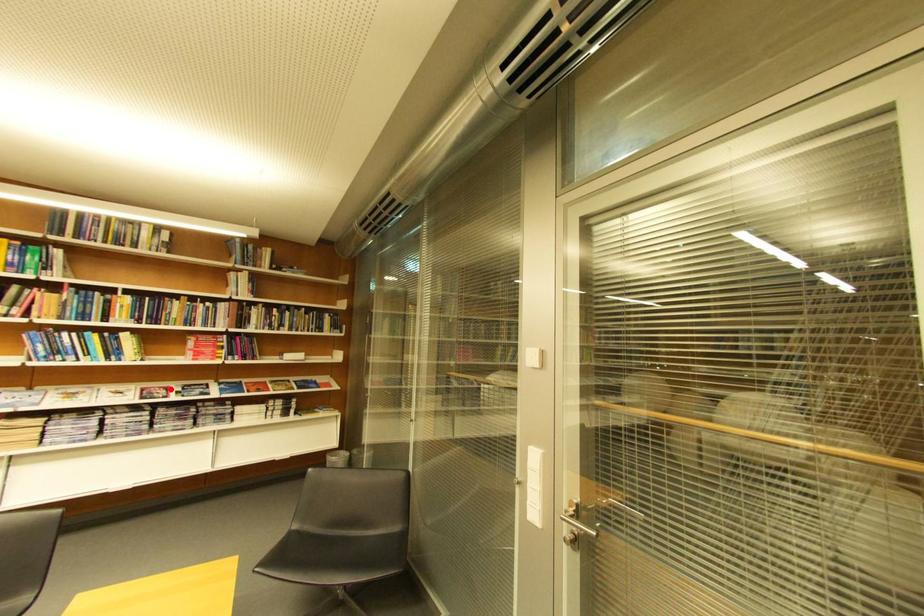
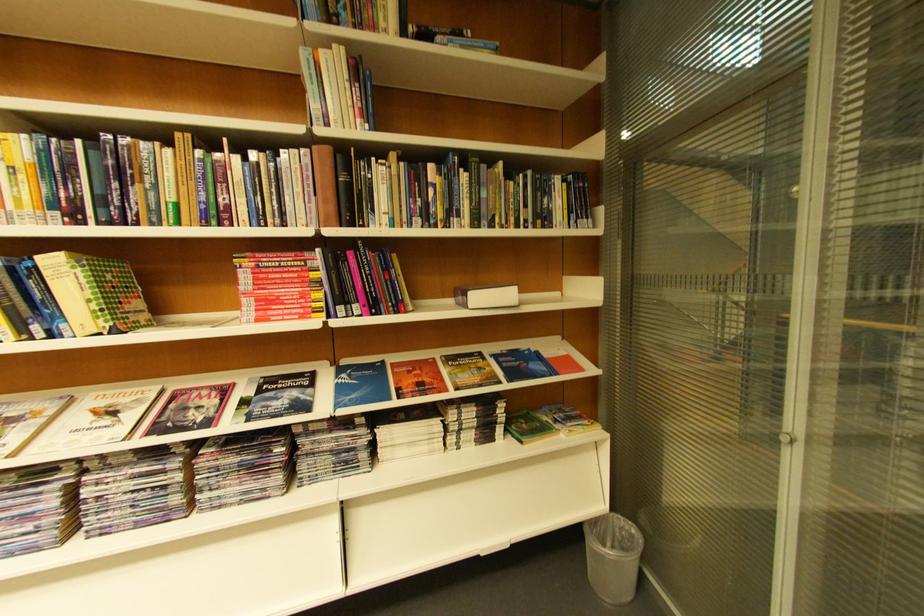
Locate, in the second image, the point that corresponds to the highlighted location in the first image.

(224, 389)